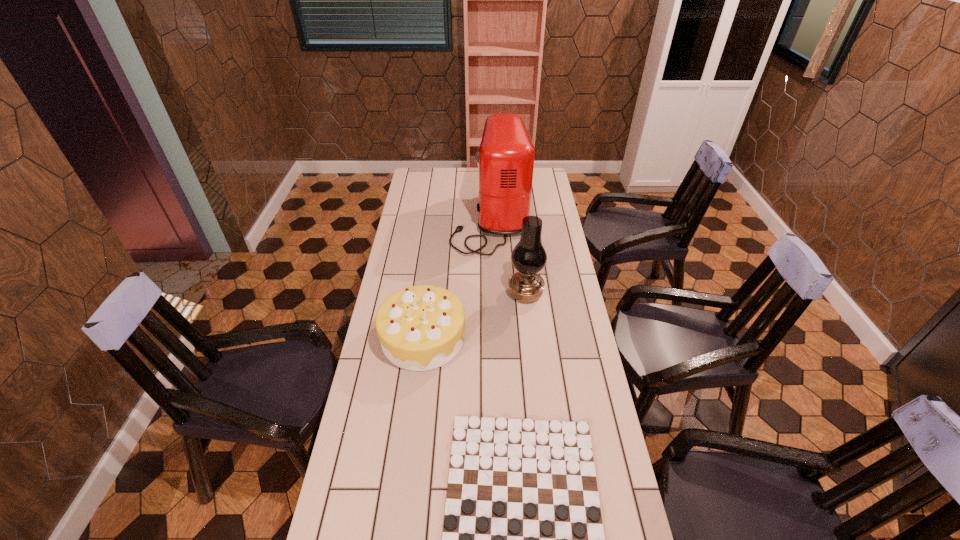
Where is `unoccupied position between the second shortest object and the second tallest object`? The width and height of the screenshot is (960, 540). unoccupied position between the second shortest object and the second tallest object is located at coordinates (474, 316).

This screenshot has width=960, height=540. Identify the location of vacant space that's between the kitchen mixer and the third tallest object. (457, 279).

Locate an element on the screen. The image size is (960, 540). vacant point located between the tallest object and the second farthest object is located at coordinates (508, 256).

Identify the location of free space between the third tallest object and the tallest object. (457, 279).

Where is `object that stands as the second closest to the nearest object`? object that stands as the second closest to the nearest object is located at coordinates (529, 257).

Select which object appears as the third closest to the third shortest object. Please provide its 2D coordinates. Your answer should be formatted as a tuple, i.e. [(x, y)], where the tuple contains the x and y coordinates of a point satisfying the conditions above.

[(523, 539)]

Find the location of a particular element. The height and width of the screenshot is (540, 960). vacant space that satisfies the following two spatial constraints: 1. on the front-facing side of the tallest object; 2. on the right side of the second tallest object is located at coordinates (493, 294).

Where is `vacant space that satisfies the following two spatial constraints: 1. on the front-facing side of the tallest object; 2. on the front side of the second shortest object`? The width and height of the screenshot is (960, 540). vacant space that satisfies the following two spatial constraints: 1. on the front-facing side of the tallest object; 2. on the front side of the second shortest object is located at coordinates (494, 338).